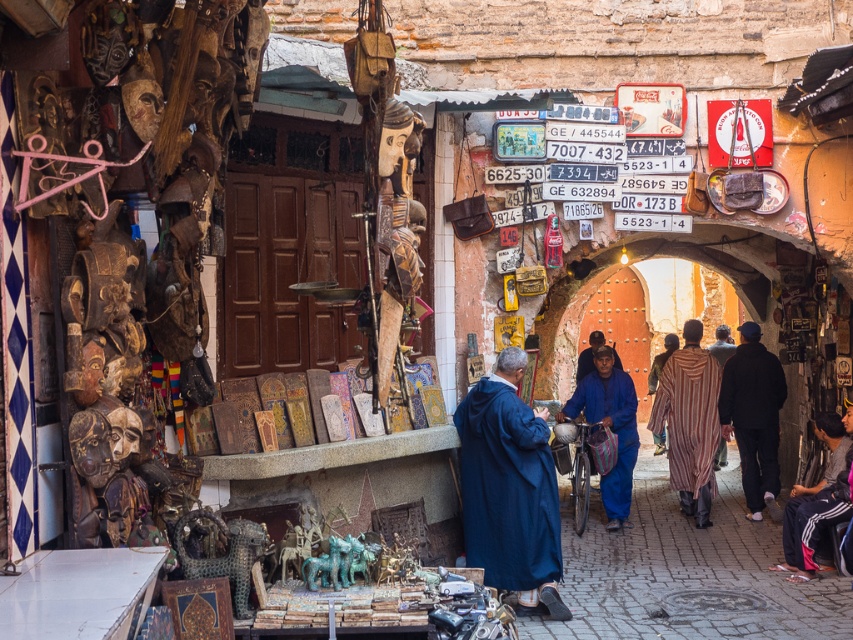
Does blue cotton robe at center appear under dark blue woolen robe at lower right?

Incorrect, blue cotton robe at center is not positioned below dark blue woolen robe at lower right.

Is point (550, 557) closer to camera compared to point (784, 557)?

Yes, it is.

Locate an element on the screen. Image resolution: width=853 pixels, height=640 pixels. blue cotton robe at center is located at coordinates (508, 488).

Does black matte jacket at right have a smaller size compared to dark blue woolen robe at lower right?

No, black matte jacket at right is not smaller than dark blue woolen robe at lower right.

Which is behind, point (772, 403) or point (811, 515)?

The point (772, 403) is behind.

Find the location of a particular element. The height and width of the screenshot is (640, 853). black matte jacket at right is located at coordinates (753, 417).

What do you see at coordinates (753, 417) in the screenshot? I see `black matte jacket at right` at bounding box center [753, 417].

Who is taller, black matte jacket at right or blue matte robe at center?

Result: With more height is black matte jacket at right.

Between point (733, 362) and point (598, 376), which one is positioned in front?

Point (598, 376) is in front.

You are a GUI agent. You are given a task and a screenshot of the screen. Output one action in this format:
    pyautogui.click(x=<x>, y=<y>)
    Task: Click on the black matte jacket at right
    This screenshot has width=853, height=640.
    Given the screenshot: What is the action you would take?
    click(x=753, y=417)